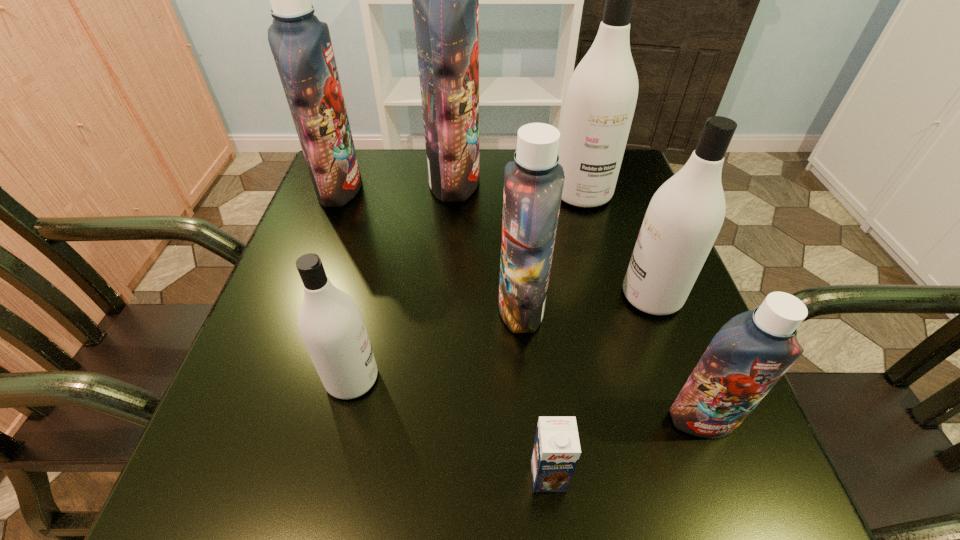
The width and height of the screenshot is (960, 540). In order to click on the biggest blue shampoo in this screenshot , I will do click(x=445, y=0).

The height and width of the screenshot is (540, 960). In order to click on the third blue shampoo from right to left in this screenshot , I will do `click(445, 0)`.

The image size is (960, 540). Identify the location of the leftmost blue shampoo. (301, 45).

This screenshot has width=960, height=540. I want to click on the leftmost object, so click(301, 45).

Find the location of a particular element. The height and width of the screenshot is (540, 960). the farthest white shampoo is located at coordinates tap(601, 97).

The width and height of the screenshot is (960, 540). I want to click on the fourth shampoo from left to right, so click(533, 183).

Identify the location of the third farthest blue shampoo. The height and width of the screenshot is (540, 960). (533, 183).

Identify the location of the second smallest white shampoo. (684, 217).

This screenshot has width=960, height=540. In order to click on the leftmost white shampoo in this screenshot , I will do `click(330, 322)`.

You are a GUI agent. You are given a task and a screenshot of the screen. Output one action in this format:
    pyautogui.click(x=<x>, y=<y>)
    Task: Click on the second shampoo from left to right
    Image resolution: width=960 pixels, height=540 pixels.
    Given the screenshot: What is the action you would take?
    pyautogui.click(x=330, y=322)